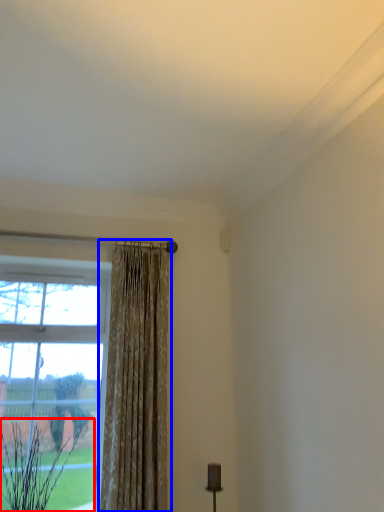
Question: Among these objects, which one is nearest to the camera, plant (highlighted by a red box) or curtain (highlighted by a blue box)?

Choices:
 (A) plant
 (B) curtain

Answer: (A)